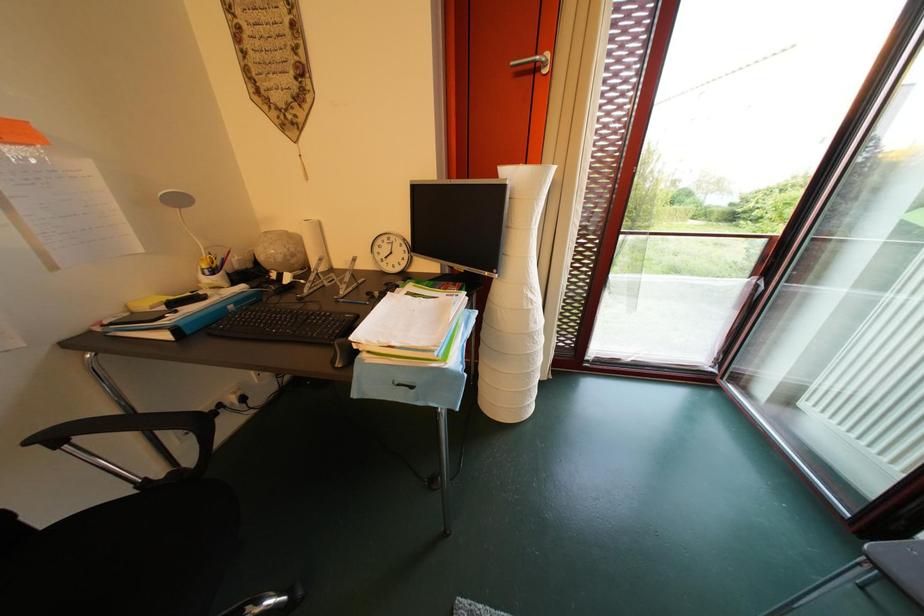
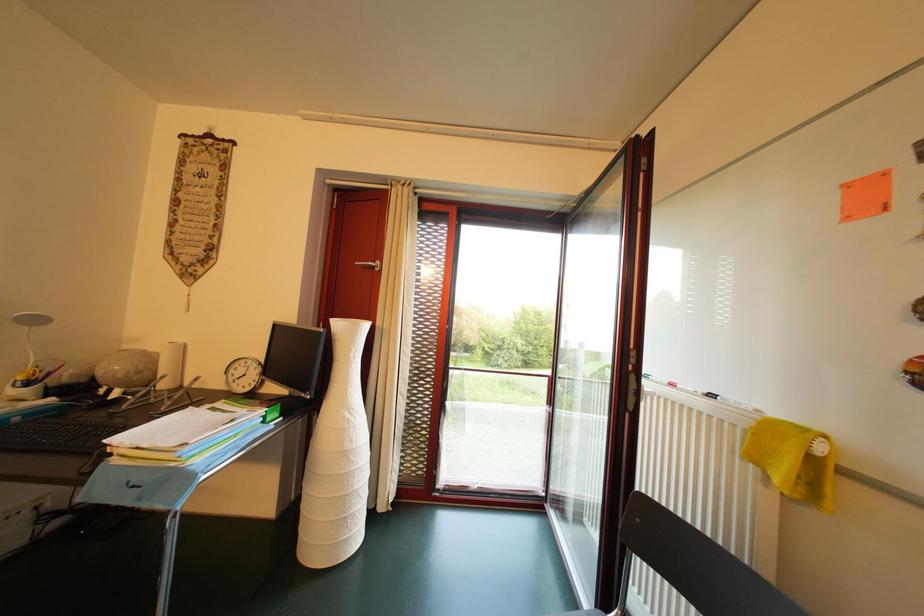
What movement of the cameraman would produce the second image?

The movement direction of the cameraman is right, backward.